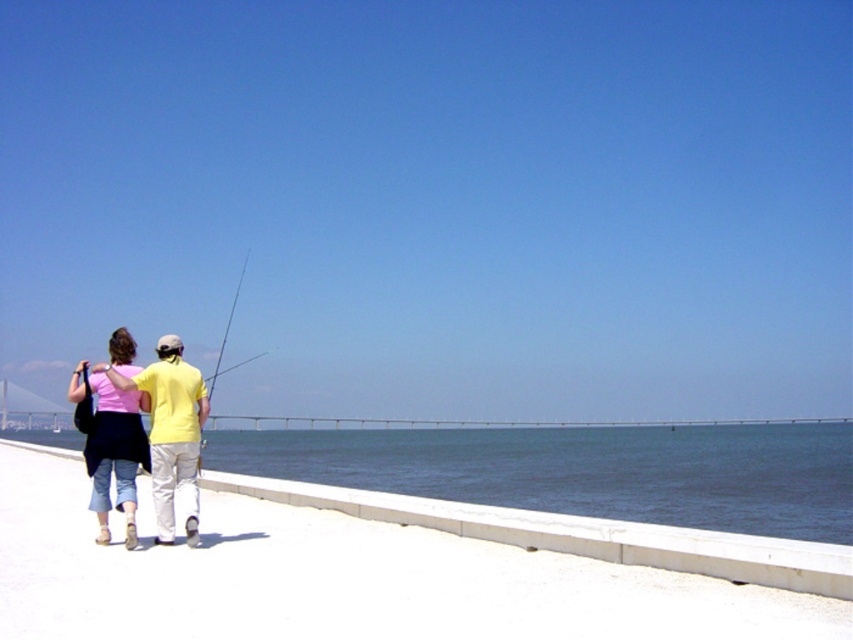
You are standing on the sandy path and want to find the pink fabric at center. According to the coordinates provided, where should you look relative to the bridge?

The pink fabric at center is located at coordinates point (143, 433), which is closer to the bridge than the water.